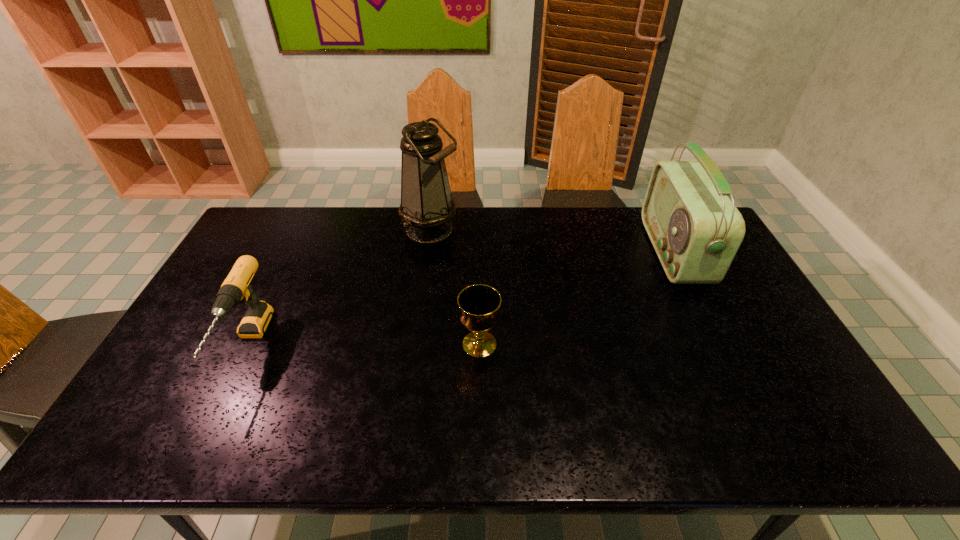
Where is `oil lamp`? The image size is (960, 540). oil lamp is located at coordinates (427, 206).

At what (x,y) coordinates should I click in order to perform the action: click on the second object from left to right. Please return your answer as a coordinate pair (x, y). Looking at the image, I should click on (427, 206).

Locate an element on the screen. radio receiver is located at coordinates (695, 229).

Identify the location of the third shortest object. (695, 229).

Locate an element on the screen. The width and height of the screenshot is (960, 540). the leftmost object is located at coordinates (236, 289).

The image size is (960, 540). What are the coordinates of `chalice` in the screenshot? It's located at (479, 304).

What are the coordinates of `free point located 0.320m on the right of the oil lamp` in the screenshot? It's located at (549, 230).

Locate an element on the screen. blank space located on the front panel of the rightmost object is located at coordinates 537,252.

Locate an element on the screen. vacant space located on the front panel of the rightmost object is located at coordinates (611, 252).

Where is `blank space located 0.120m on the front panel of the rightmost object`? This screenshot has width=960, height=540. blank space located 0.120m on the front panel of the rightmost object is located at coordinates (616, 252).